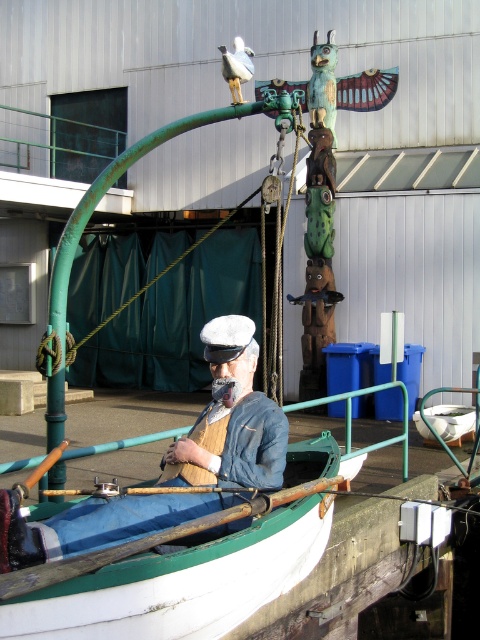
Who is more forward, (163, 556) or (240, 65)?

Point (163, 556) is in front.

Which of these two, white painted wood boat at center or white matte bird at upper center, stands taller?

white painted wood boat at center

This screenshot has width=480, height=640. I want to click on white painted wood boat at center, so click(180, 584).

Is denim jacket at center wider than green patina totem pole at upper center?

Yes, denim jacket at center is wider than green patina totem pole at upper center.

Is denim jacket at center smaller than green patina totem pole at upper center?

Actually, denim jacket at center might be larger than green patina totem pole at upper center.

Find the location of a particular element. The height and width of the screenshot is (640, 480). denim jacket at center is located at coordinates (230, 419).

Consider the image. Is green patina totem pole at upper center closer to camera compared to white matte bird at upper center?

That is False.

Is green patina totem pole at upper center smaller than white matte bird at upper center?

No.

Find the location of a particular element. The height and width of the screenshot is (640, 480). green patina totem pole at upper center is located at coordinates (335, 88).